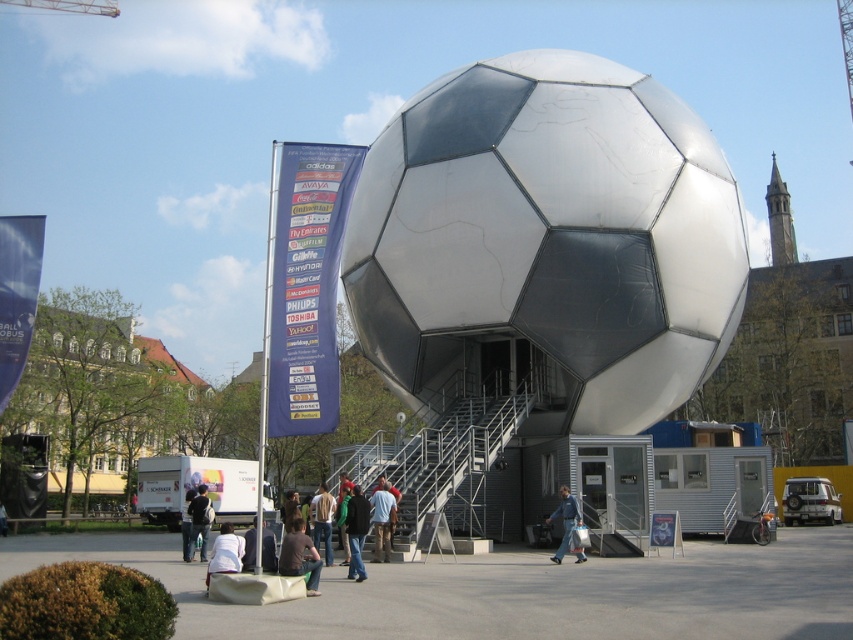
Question: From the image, what is the correct spatial relationship of denim jacket at lower center in relation to dark blue backpack at center?

Choices:
 (A) left
 (B) right

Answer: (B)

Question: Is denim jacket at lower center smaller than dark blue backpack at center?

Choices:
 (A) no
 (B) yes

Answer: (B)

Question: Which point appears farthest from the camera in this image?

Choices:
 (A) (206, 545)
 (B) (561, 500)

Answer: (B)

Question: Which point is farther from the camera taking this photo?

Choices:
 (A) (567, 509)
 (B) (196, 492)

Answer: (B)

Question: Does denim jacket at lower center appear on the right side of dark blue backpack at center?

Choices:
 (A) no
 (B) yes

Answer: (B)